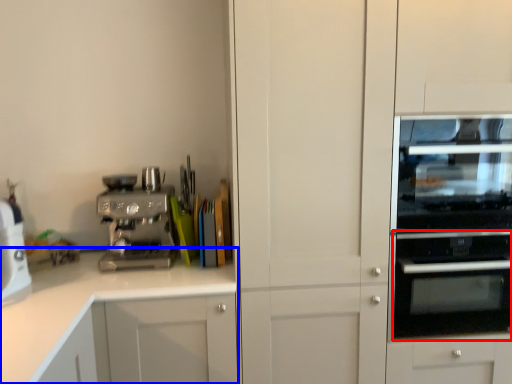
Question: Among these objects, which one is farthest to the camera, oven (highlighted by a red box) or cabinetry (highlighted by a blue box)?

Choices:
 (A) oven
 (B) cabinetry

Answer: (A)